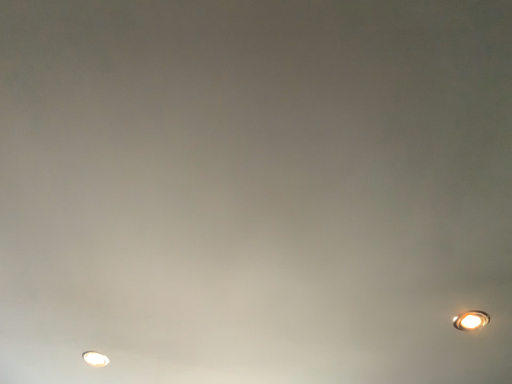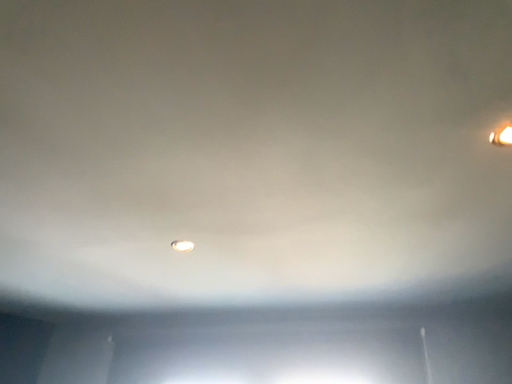
Question: How did the camera likely rotate when shooting the video?

Choices:
 (A) rotated upward
 (B) rotated downward

Answer: (B)